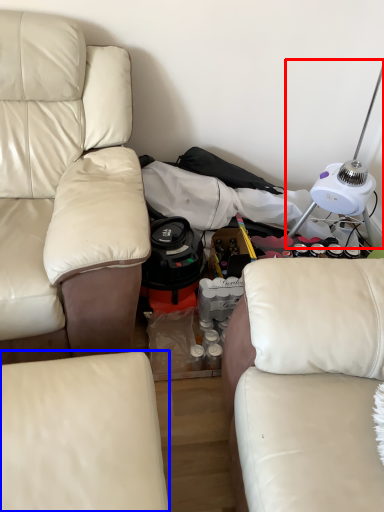
Question: Which point is further to the camera, table lamp (highlighted by a red box) or studio couch (highlighted by a blue box)?

Choices:
 (A) table lamp
 (B) studio couch

Answer: (A)